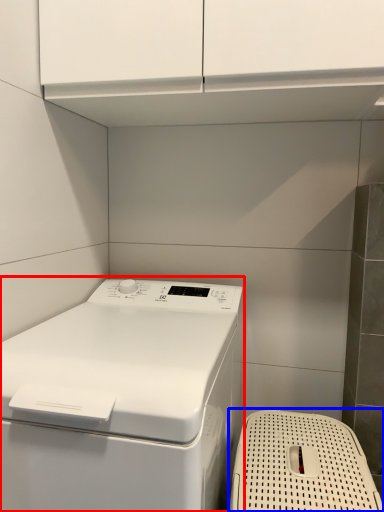
Question: Which point is further to the camera, home appliance (highlighted by a red box) or dish washer (highlighted by a blue box)?

Choices:
 (A) home appliance
 (B) dish washer

Answer: (B)